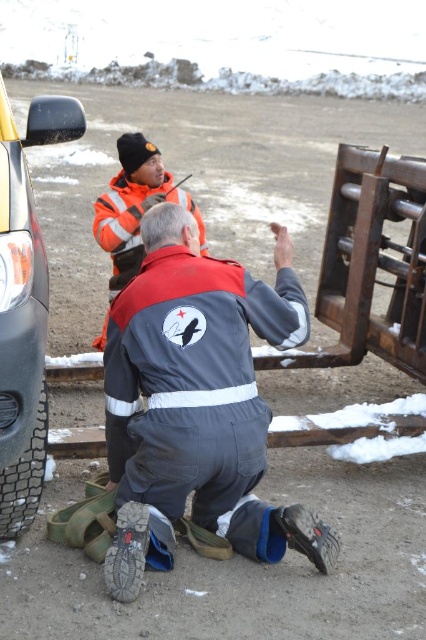
Can you confirm if black rubber tire at left is positioned below black rubber tire at lower left?

Incorrect, black rubber tire at left is not positioned below black rubber tire at lower left.

Identify the location of black rubber tire at left. This screenshot has height=640, width=426. (25, 308).

Identify the location of gray fabric jumpsuit at center. (198, 403).

Is point (166, 248) positioned after point (31, 435)?

Yes.

Is point (178, 244) positioned after point (39, 493)?

Yes, point (178, 244) is behind point (39, 493).

At what (x,y) coordinates should I click in order to perform the action: click on gray fabric jumpsuit at center. Please return your answer as a coordinate pair (x, y). The height and width of the screenshot is (640, 426). Looking at the image, I should click on (198, 403).

In the scene shown: Does gray fabric jumpsuit at center appear on the right side of black rubber tire at left?

Correct, you'll find gray fabric jumpsuit at center to the right of black rubber tire at left.

Which of these two, gray fabric jumpsuit at center or black rubber tire at left, stands shorter?

gray fabric jumpsuit at center is shorter.

I want to click on gray fabric jumpsuit at center, so click(x=198, y=403).